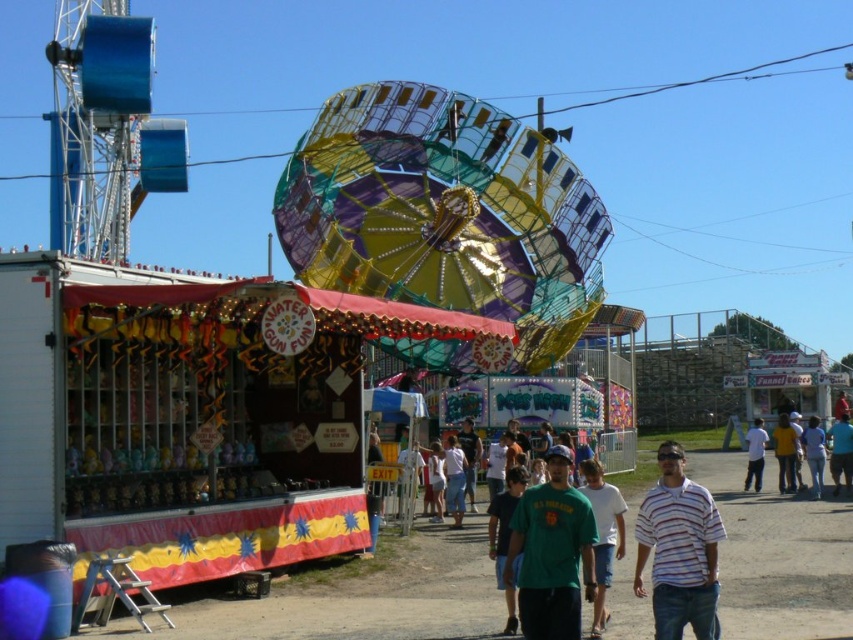
Looking at this image, you are a photographer at the carnival and need to capture both the green matte shirt at center and the blue fabric shirt at lower right in a single frame. Which shirt should you focus on to ensure both are in the shot without zooming in too much?

The green matte shirt at center is smaller than the blue fabric shirt at lower right, so focusing on the blue fabric shirt at lower right would allow both shirts to fit within the frame without excessive zooming.

You are a photographer at the carnival and want to capture both the green matte shirt at center and the white cotton shirt at lower right in a single photo. Which shirt should you focus on first to ensure both are in the frame?

The green matte shirt at center is below the white cotton shirt at lower right, so you should focus on the white cotton shirt at lower right first to ensure both are in the frame.

You are standing at the fair and see the blue jeans at lower right and the white cotton shirt at lower right. Which clothing item is nearer to you?

The blue jeans at lower right is closer to the viewer than the white cotton shirt at lower right.